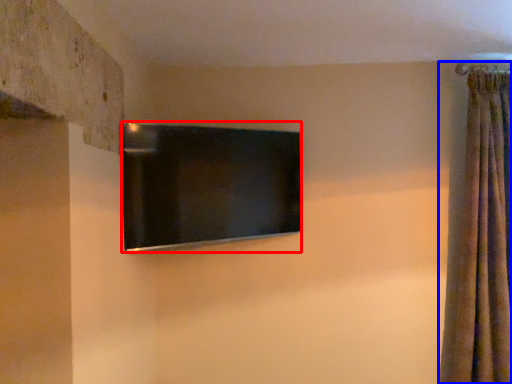
Question: Which object is further to the camera taking this photo, television (highlighted by a red box) or curtain (highlighted by a blue box)?

Choices:
 (A) television
 (B) curtain

Answer: (B)